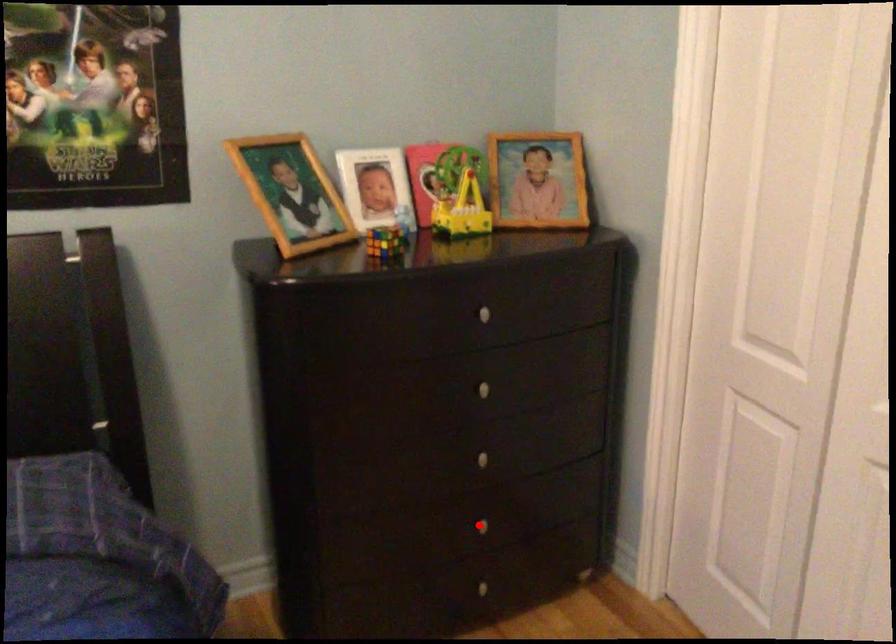
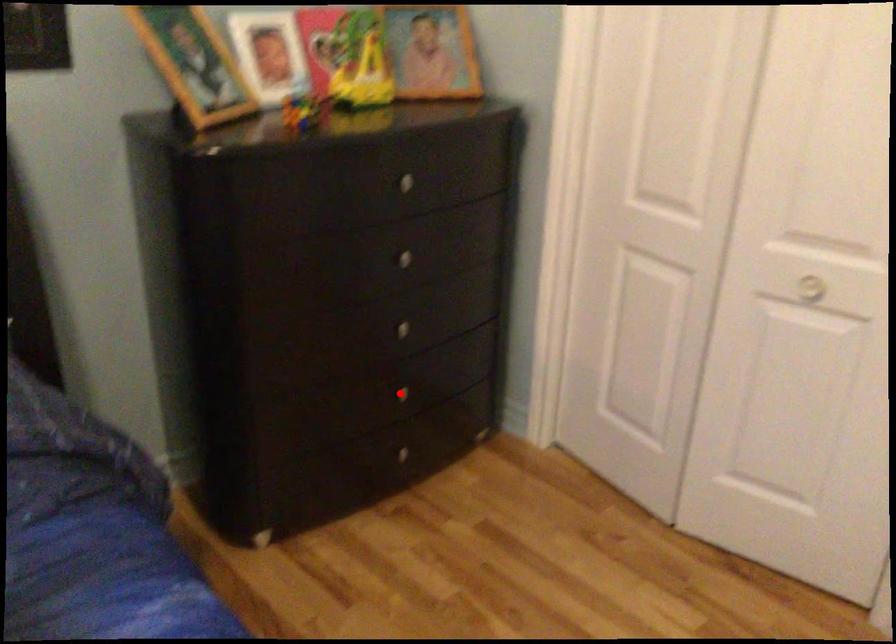
I am providing you with two images of the same scene from different viewpoints. A red point is marked on the first image and another point is marked on the second image. Are the points marked in image1 and image2 representing the same 3D position?

Yes